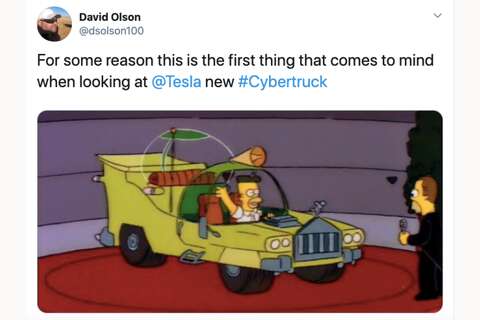
Find the location of a particular element. rug is located at coordinates (326, 292).